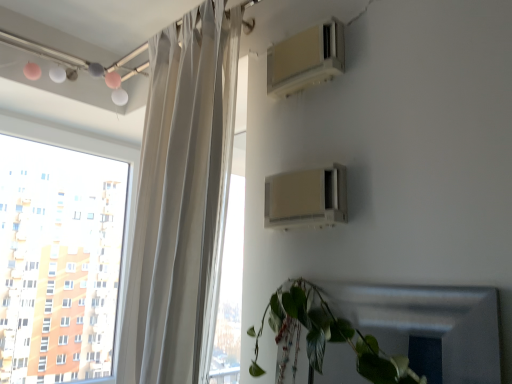
Question: Would you say beige plastic air conditioner at upper center, which is counted as the 2th air conditioning, starting from the bottom, is to the left or to the right of white sheer curtain at left in the picture?

Choices:
 (A) left
 (B) right

Answer: (B)

Question: Is point (279, 46) positioned closer to the camera than point (193, 18)?

Choices:
 (A) farther
 (B) closer

Answer: (B)

Question: Based on their relative distances, which object is nearer to the transparent glass window at upper left?

Choices:
 (A) beige plastic air conditioner at upper center, which is counted as the 2th air conditioning, starting from the bottom
 (B) white sheer curtain at left
 (C) green matte leafy plant at lower right
 (D) beige plastic air conditioner at upper right, which ranks as the first air conditioning in bottom-to-top order

Answer: (B)

Question: Based on their relative distances, which object is farther from the beige plastic air conditioner at upper center, which is counted as the 2th air conditioning, starting from the bottom?

Choices:
 (A) white sheer curtain at left
 (B) transparent glass window at upper left
 (C) green matte leafy plant at lower right
 (D) beige plastic air conditioner at upper right, which ranks as the first air conditioning in bottom-to-top order

Answer: (B)